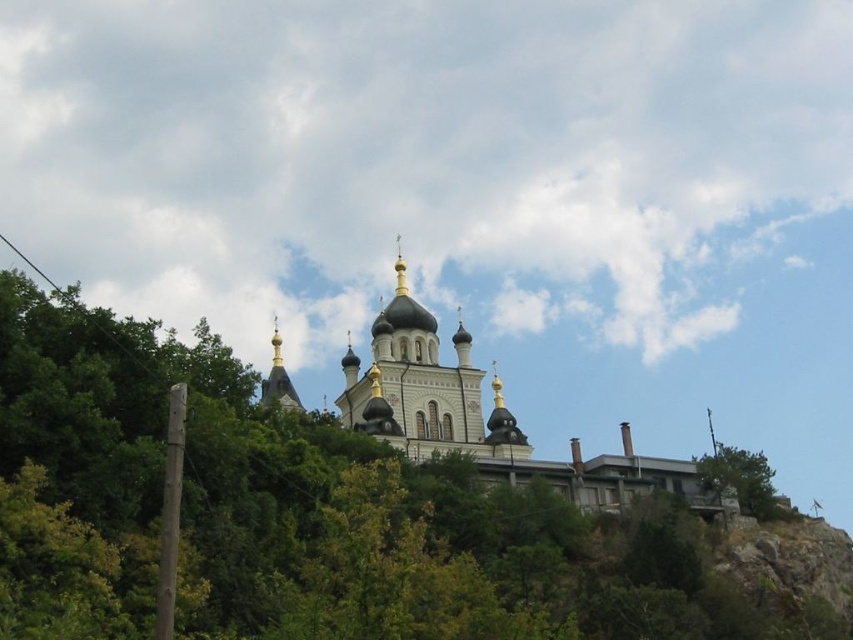
Question: Which of the following is the closest to the observer?

Choices:
 (A) green leafy tree at lower right
 (B) white stone church at upper center
 (C) white stone tower at center

Answer: (B)

Question: Does white stone church at upper center have a smaller size compared to white stone tower at center?

Choices:
 (A) yes
 (B) no

Answer: (B)

Question: Can you confirm if white stone church at upper center is bigger than white stone tower at center?

Choices:
 (A) yes
 (B) no

Answer: (A)

Question: Does white stone church at upper center appear on the left side of white stone tower at center?

Choices:
 (A) yes
 (B) no

Answer: (B)

Question: Which point is closer to the camera?

Choices:
 (A) white stone tower at center
 (B) white stone church at upper center
 (C) green leafy tree at lower right

Answer: (B)

Question: Which is nearer to the white stone church at upper center?

Choices:
 (A) white stone tower at center
 (B) green leafy tree at lower right

Answer: (A)